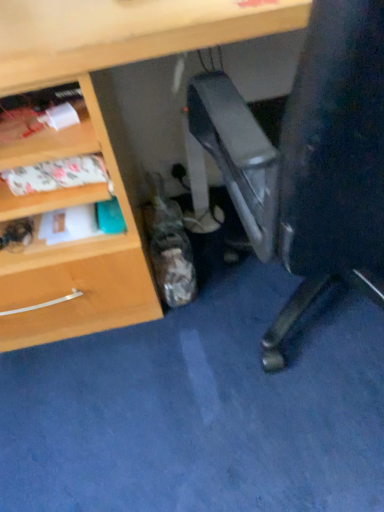
Question: Should I look upward or downward to see white glossy paper at upper left?

Choices:
 (A) down
 (B) up

Answer: (B)